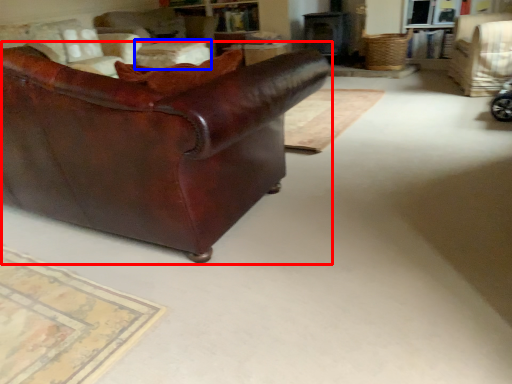
Question: Which point is further to the camera, studio couch (highlighted by a red box) or table (highlighted by a blue box)?

Choices:
 (A) studio couch
 (B) table

Answer: (B)